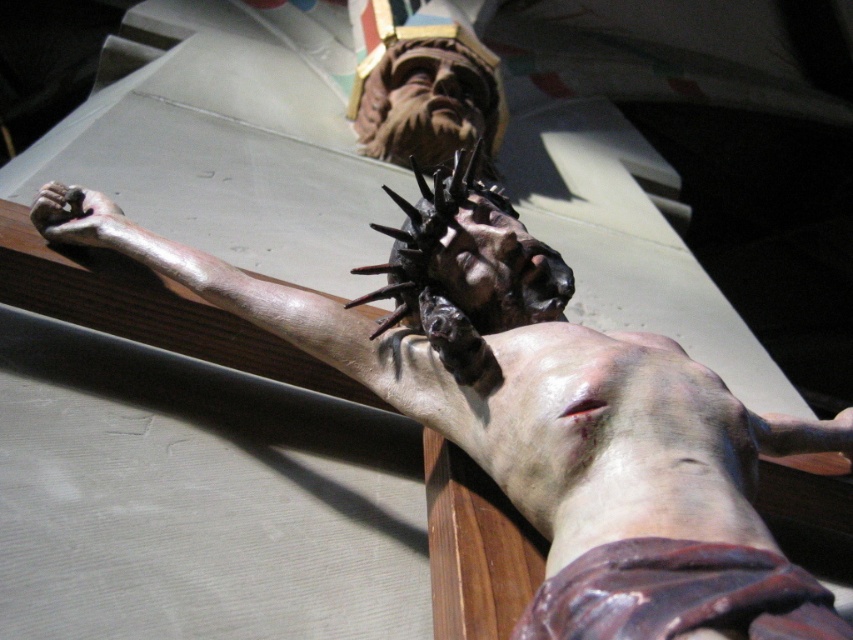
Consider the image. Is matte brown statue at center positioned behind matte brown hand at lower left?

No, it is not.

The width and height of the screenshot is (853, 640). Identify the location of matte brown statue at center. (564, 432).

Find the location of a particular element. The height and width of the screenshot is (640, 853). matte brown statue at center is located at coordinates (564, 432).